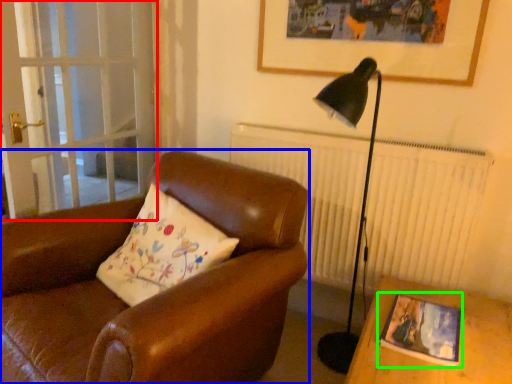
Question: Estimate the real-world distances between objects in this image. Which object is farther from screen door (highlighted by a red box), chair (highlighted by a blue box) or picture frame (highlighted by a green box)?

Choices:
 (A) chair
 (B) picture frame

Answer: (B)